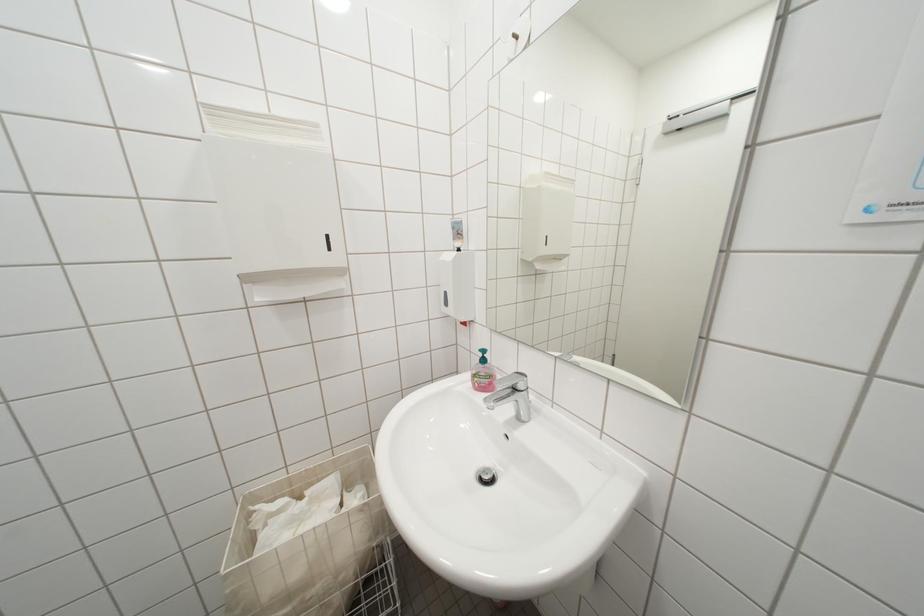
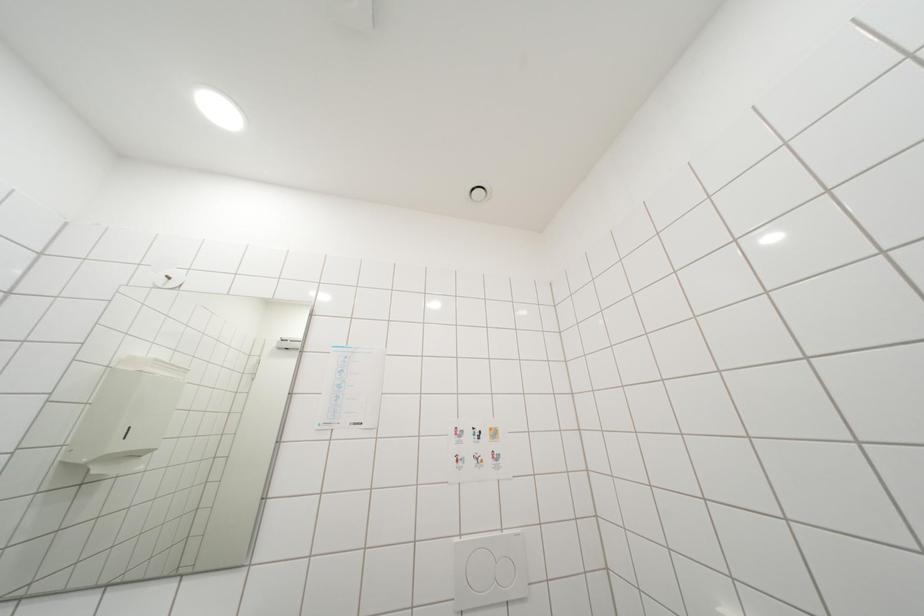
Based on the continuous images, in which direction is the camera rotating?

The camera's rotation is toward right-up.